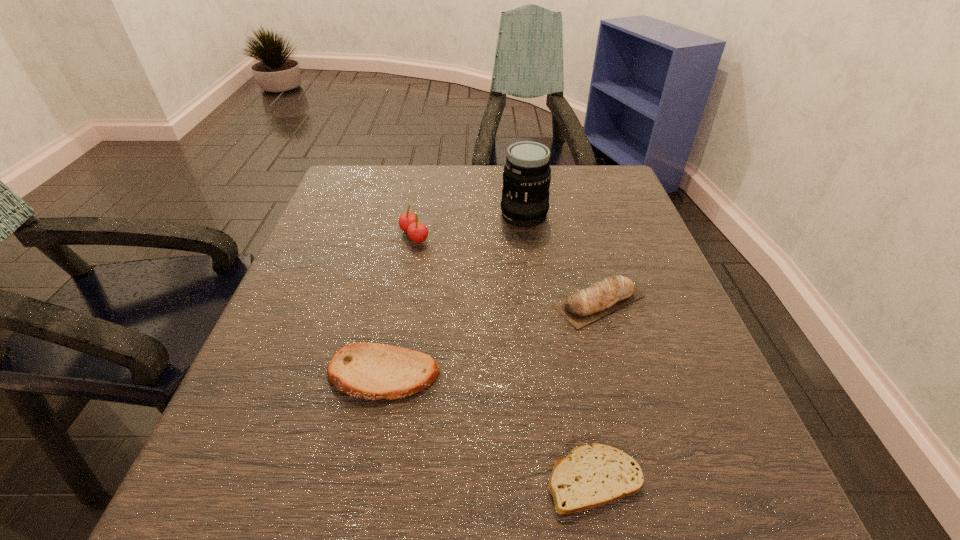
The image size is (960, 540). In the image, there is a desktop. What are the coordinates of `vacant space at the right edge` in the screenshot? It's located at pos(643,227).

In the image, there is a desktop. Identify the location of free space at the far left corner. (385, 180).

The height and width of the screenshot is (540, 960). I want to click on free space at the far right corner of the desktop, so click(x=582, y=173).

In the image, there is a desktop. In order to click on vacant region at the near right corner in this screenshot , I will do `click(723, 491)`.

The width and height of the screenshot is (960, 540). Find the location of `free space between the shortest object and the tallest pita bread`. free space between the shortest object and the tallest pita bread is located at coordinates (597, 390).

Identify the location of vacant area between the cherry and the leftmost pita bread. (398, 305).

The width and height of the screenshot is (960, 540). Find the location of `unoccupied area between the second tallest pita bread and the tallest object`. unoccupied area between the second tallest pita bread and the tallest object is located at coordinates (453, 295).

Identify the location of vacant area between the farthest pita bread and the fourth shortest object. The image size is (960, 540). (507, 268).

You are a GUI agent. You are given a task and a screenshot of the screen. Output one action in this format:
    pyautogui.click(x=<x>, y=<y>)
    Task: Click on the free point between the farthest pita bread and the leftmost pita bread
    The image size is (960, 540).
    Given the screenshot: What is the action you would take?
    pyautogui.click(x=492, y=338)

You are a GUI agent. You are given a task and a screenshot of the screen. Output one action in this format:
    pyautogui.click(x=<x>, y=<y>)
    Task: Click on the vacant space that's between the tallest object and the tallest pita bread
    This screenshot has height=540, width=960.
    Given the screenshot: What is the action you would take?
    pyautogui.click(x=562, y=258)